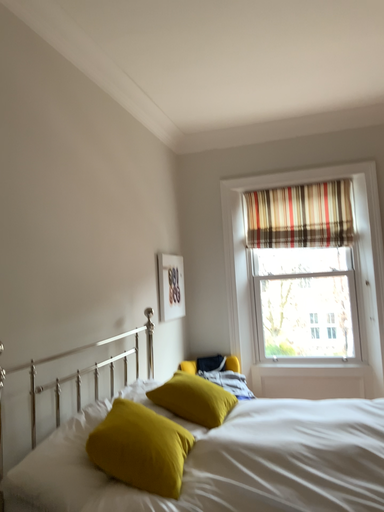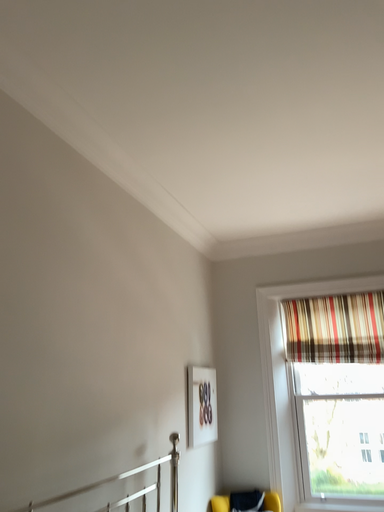
Question: Which way did the camera rotate in the video?

Choices:
 (A) rotated upward
 (B) rotated downward

Answer: (A)